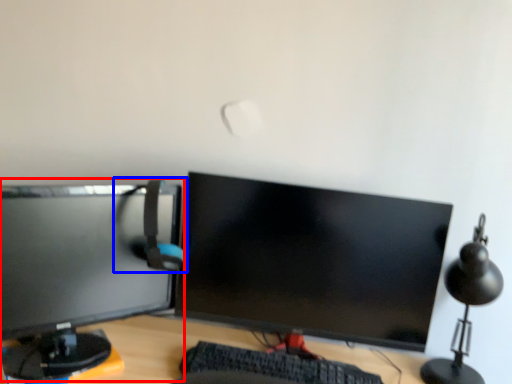
Question: Which of the following is the closest to the observer, computer monitor (highlighted by a red box) or computer chair (highlighted by a blue box)?

Choices:
 (A) computer monitor
 (B) computer chair

Answer: (A)